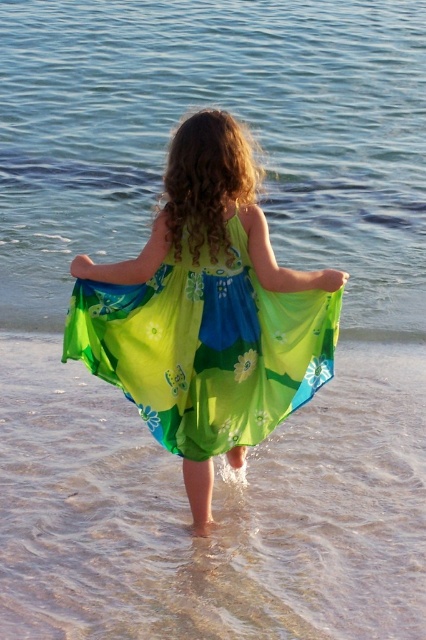
You are a photographer trying to capture the girl in the image. To get a clear shot of her dress, you need to know the position of the translucent blue water at center and the translucent sand at lower center. Which object is positioned to the left of the other?

The translucent blue water at center is to the left of the translucent sand at lower center.